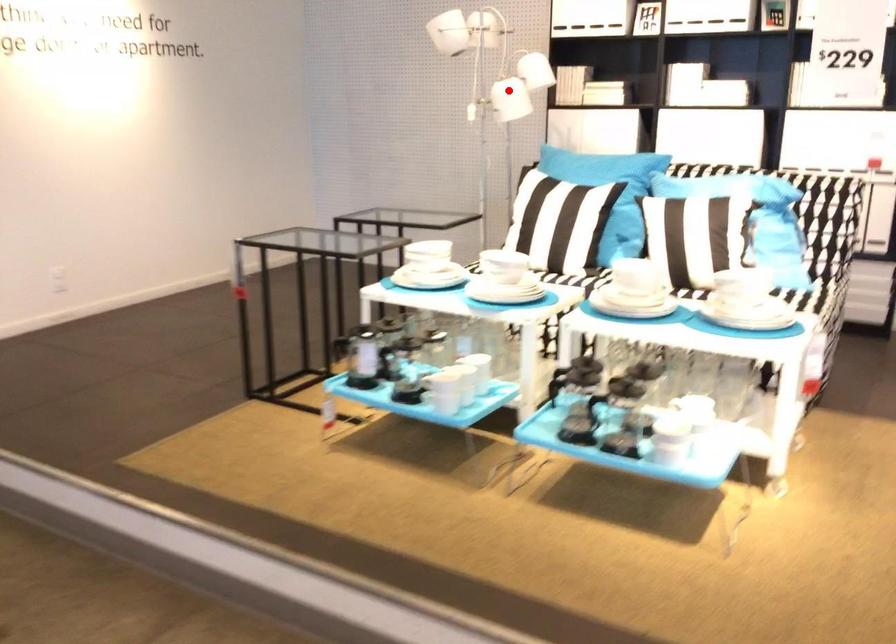
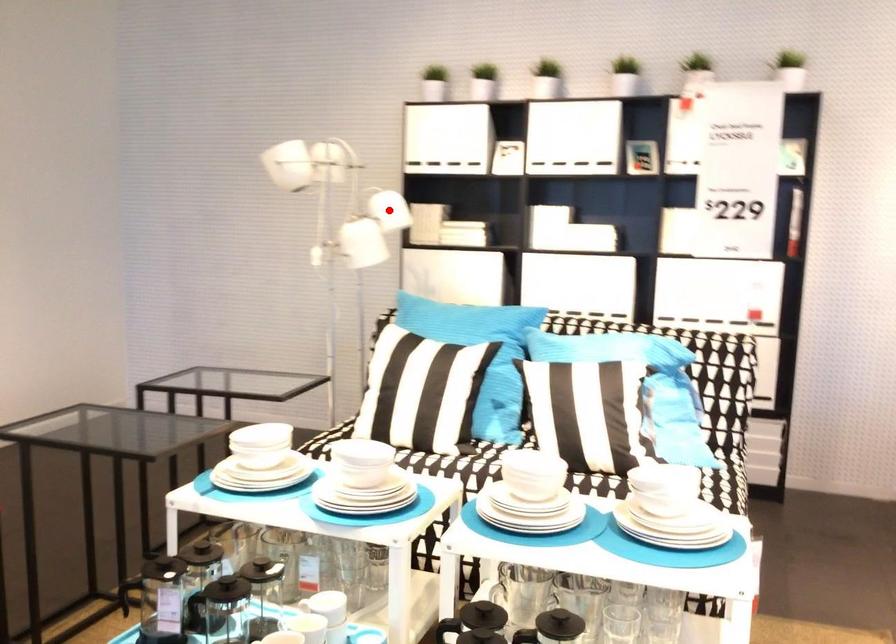
I am providing you with two images of the same scene from different viewpoints. A red point is marked on the first image and another point is marked on the second image. Is the red point in image1 aligned with the point shown in image2?

No